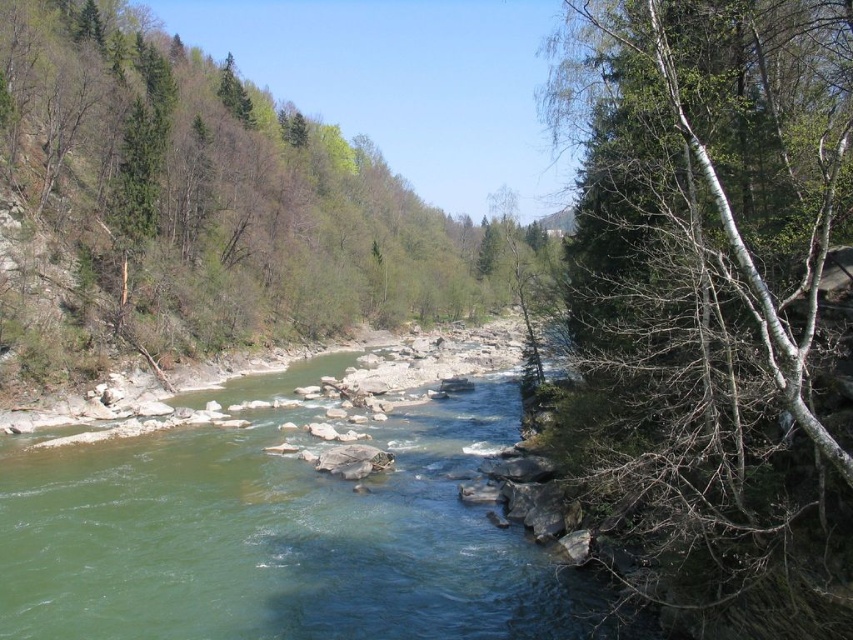
Question: Considering the relative positions of white bark tree at right and green smooth river at center in the image provided, where is white bark tree at right located with respect to green smooth river at center?

Choices:
 (A) right
 (B) left

Answer: (A)

Question: Can you confirm if green leafy tree at center is positioned below green smooth river at center?

Choices:
 (A) no
 (B) yes

Answer: (A)

Question: Which point is closer to the camera taking this photo?

Choices:
 (A) (630, 465)
 (B) (38, 349)
 (C) (410, 508)

Answer: (A)

Question: Among these objects, which one is farthest from the camera?

Choices:
 (A) green smooth river at center
 (B) white bark tree at right
 (C) green leafy tree at center

Answer: (C)

Question: Among these points, which one is farthest from the camera?

Choices:
 (A) (560, 76)
 (B) (80, 259)
 (C) (68, 593)

Answer: (B)

Question: Is green leafy tree at center positioned before green smooth river at center?

Choices:
 (A) yes
 (B) no

Answer: (B)